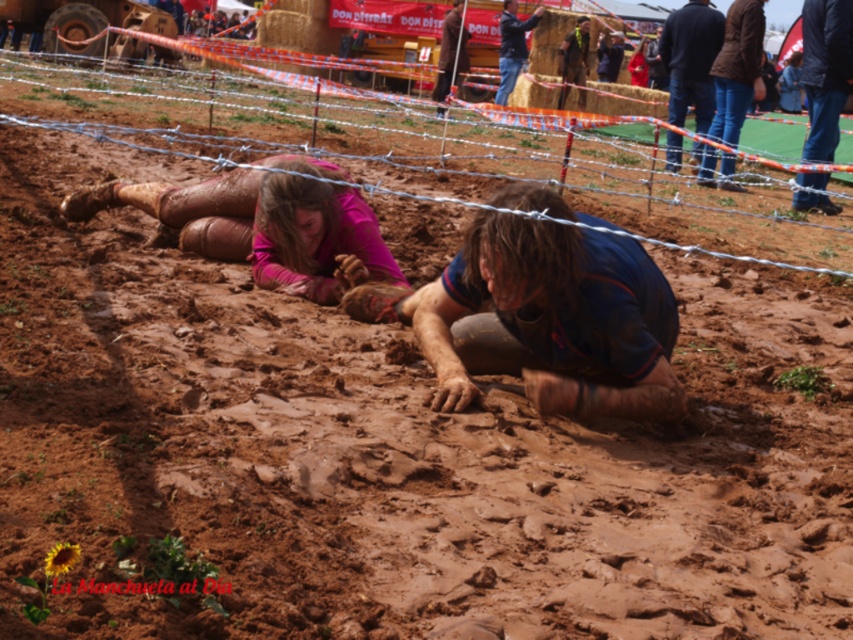
You are a participant in the mud run and need to crawl under the barbed wire at center to reach the finish line. Can you safely crawl under it while keeping your head above the dark blue shirt at upper right?

The barbed wire at center is located below the dark blue shirt at upper right, so crawling under the barbed wire at center would require lowering your head below the dark blue shirt at upper right, which may not be safe due to the wire being lower than the shirt position.